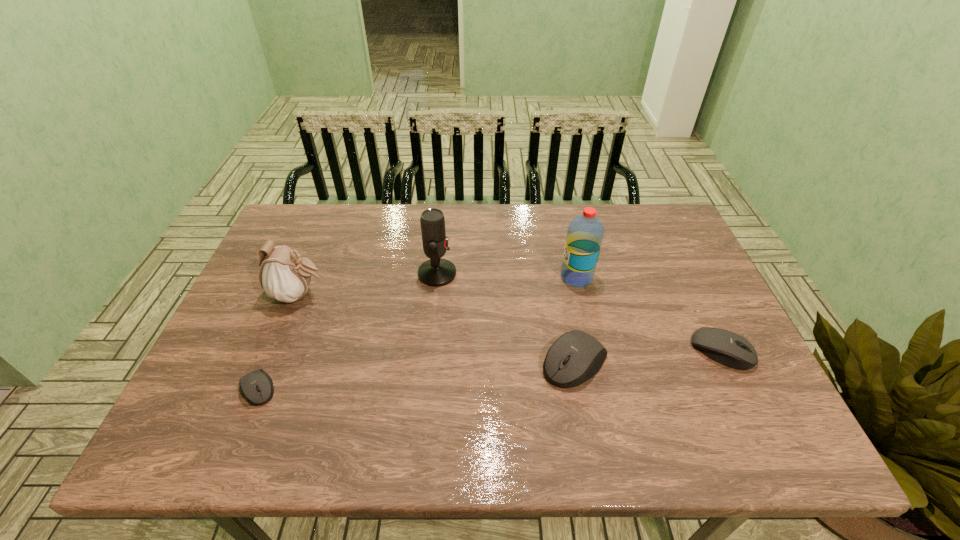
Image resolution: width=960 pixels, height=540 pixels. In the image, there is a desktop. Identify the location of vacant space at the far edge. (576, 205).

The height and width of the screenshot is (540, 960). Find the location of `vacant point at the near edge`. vacant point at the near edge is located at coordinates [358, 397].

The height and width of the screenshot is (540, 960). Identify the location of free region at the right edge of the desktop. (644, 250).

In the image, there is a desktop. Where is `free region at the near left corner`? The height and width of the screenshot is (540, 960). free region at the near left corner is located at coordinates (190, 401).

I want to click on vacant space at the far right corner of the desktop, so click(x=636, y=210).

The image size is (960, 540). I want to click on blank space at the near right corner, so click(733, 384).

I want to click on free space between the microphone and the water bottle, so click(x=507, y=275).

The width and height of the screenshot is (960, 540). Find the location of `free point between the second computer equipment from right to left and the second shortest computer equipment`. free point between the second computer equipment from right to left and the second shortest computer equipment is located at coordinates (649, 356).

You are a GUI agent. You are given a task and a screenshot of the screen. Output one action in this format:
    pyautogui.click(x=<x>, y=<y>)
    Task: Click on the free spot between the second computer equipment from right to left and the second tallest computer equipment
    Image resolution: width=960 pixels, height=540 pixels.
    Given the screenshot: What is the action you would take?
    pyautogui.click(x=649, y=356)

Where is `free area in between the water bottle and the fourth object from right to left`? free area in between the water bottle and the fourth object from right to left is located at coordinates (507, 275).